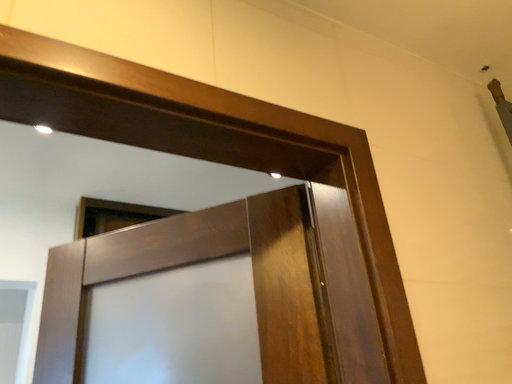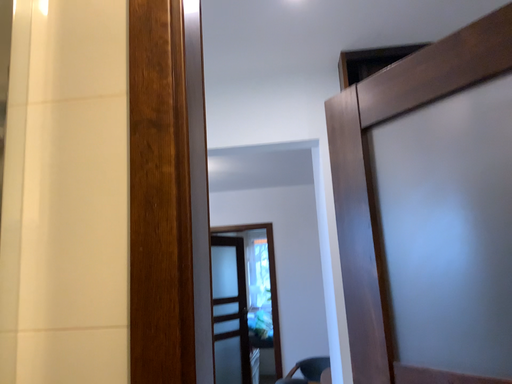
Question: Which way did the camera rotate in the video?

Choices:
 (A) rotated downward
 (B) rotated upward

Answer: (A)